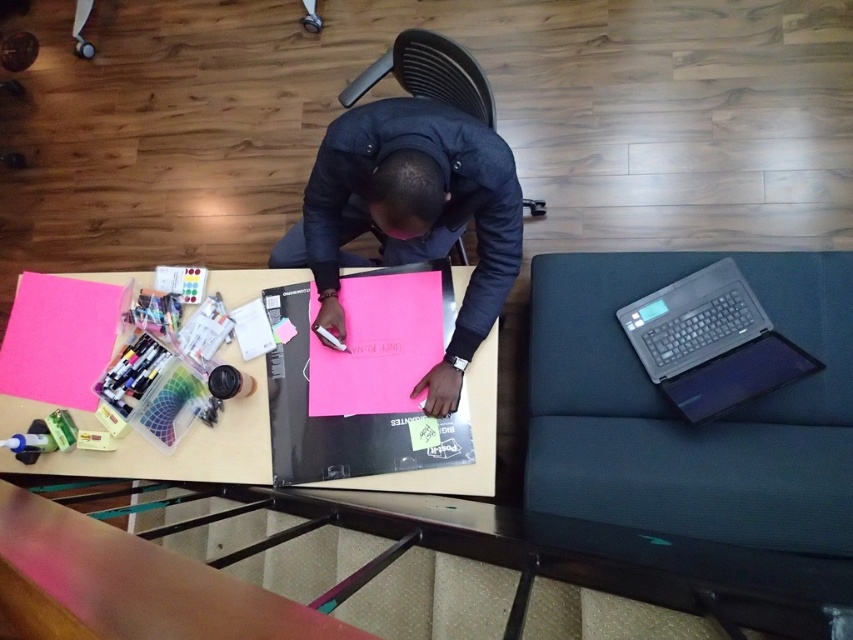
You are a person sitting at the workspace. You want to reach the pink paper at center without moving the black plastic chair at center. Is it possible?

The black plastic chair at center is behind the pink paper at center, so you can reach the pink paper at center by moving around the chair or from the front side where the chair is not blocking.